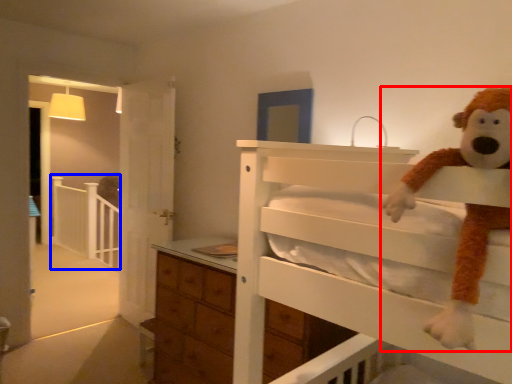
Question: Among these objects, which one is nearest to the camera, toy (highlighted by a red box) or balustrade (highlighted by a blue box)?

Choices:
 (A) toy
 (B) balustrade

Answer: (A)